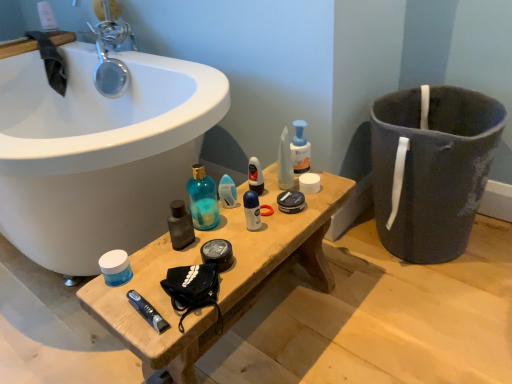
Identify the location of vacant space to the right of white matte deodorant at center, arranged as the 2th toiletry when viewed from the left. (301, 210).